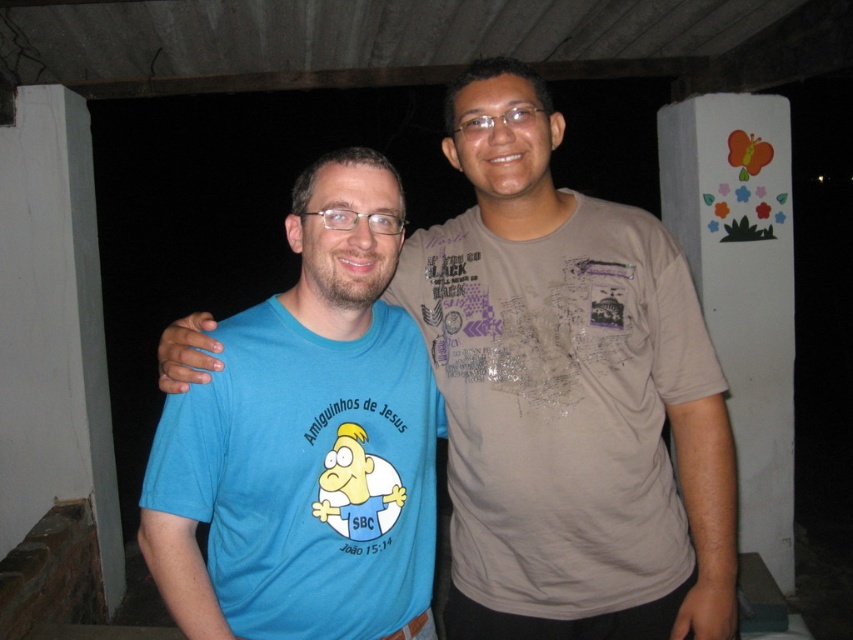
Does matte blue t-shirt at center have a lesser width compared to white painted pillar at right?

Indeed, matte blue t-shirt at center has a lesser width compared to white painted pillar at right.

In the scene shown: Does matte blue t-shirt at center appear under white painted pillar at right?

Yes, matte blue t-shirt at center is below white painted pillar at right.

Describe the element at coordinates (308, 476) in the screenshot. I see `matte blue t-shirt at center` at that location.

Find the location of a particular element. matte blue t-shirt at center is located at coordinates (308, 476).

From the picture: Between blue cotton shirt at center and matte blue t-shirt at center, which one appears on the left side from the viewer's perspective?

Positioned to the left is matte blue t-shirt at center.

Based on the photo, between blue cotton shirt at center and matte blue t-shirt at center, which one has less height?

matte blue t-shirt at center

Which is behind, point (480, 440) or point (274, 572)?

Positioned behind is point (480, 440).

Locate an element on the screen. The height and width of the screenshot is (640, 853). blue cotton shirt at center is located at coordinates (567, 394).

Describe the element at coordinates (561, 404) in the screenshot. The width and height of the screenshot is (853, 640). I see `matte brown t-shirt at center` at that location.

Can you confirm if matte brown t-shirt at center is smaller than matte blue t-shirt at center?

Incorrect, matte brown t-shirt at center is not smaller in size than matte blue t-shirt at center.

What do you see at coordinates (561, 404) in the screenshot? I see `matte brown t-shirt at center` at bounding box center [561, 404].

Identify the location of matte brown t-shirt at center. (561, 404).